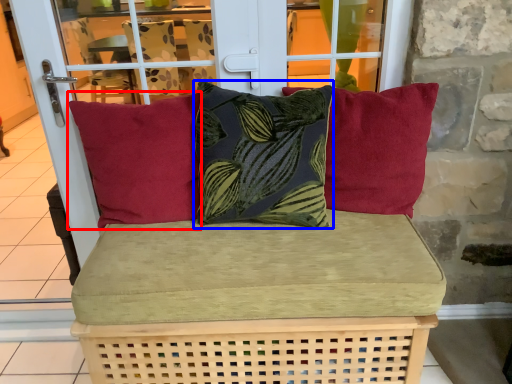
Question: Which point is further to the camera, pillow (highlighted by a red box) or pillow (highlighted by a blue box)?

Choices:
 (A) pillow
 (B) pillow

Answer: (A)